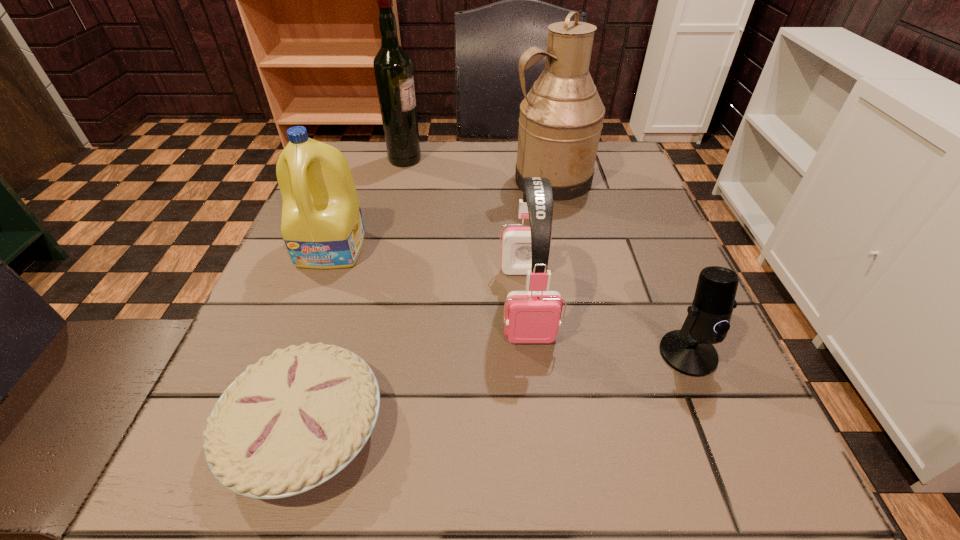
Locate an element on the screen. microphone that is at the right edge is located at coordinates (689, 351).

Find the location of a particular element. object that is at the far left corner is located at coordinates (393, 68).

You are a GUI agent. You are given a task and a screenshot of the screen. Output one action in this format:
    pyautogui.click(x=<x>, y=<y>)
    Task: Click on the object that is at the near left corner
    
    Given the screenshot: What is the action you would take?
    pyautogui.click(x=290, y=422)

At what (x,y) coordinates should I click in order to perform the action: click on object present at the far right corner. Please return your answer as a coordinate pair (x, y). The width and height of the screenshot is (960, 540). Looking at the image, I should click on (561, 118).

This screenshot has width=960, height=540. In the image, there is a desktop. Find the location of `vacant space at the far edge`. vacant space at the far edge is located at coordinates (468, 173).

Where is `vacant space at the near edge`? The width and height of the screenshot is (960, 540). vacant space at the near edge is located at coordinates tap(506, 490).

Where is `vacant space at the left edge of the desktop`? vacant space at the left edge of the desktop is located at coordinates (238, 355).

Where is `free spot at the right edge of the desktop`? Image resolution: width=960 pixels, height=540 pixels. free spot at the right edge of the desktop is located at coordinates (724, 394).

The image size is (960, 540). What are the coordinates of `blank space at the near left corner` in the screenshot? It's located at (229, 496).

The height and width of the screenshot is (540, 960). I want to click on free space at the far right corner, so click(x=607, y=190).